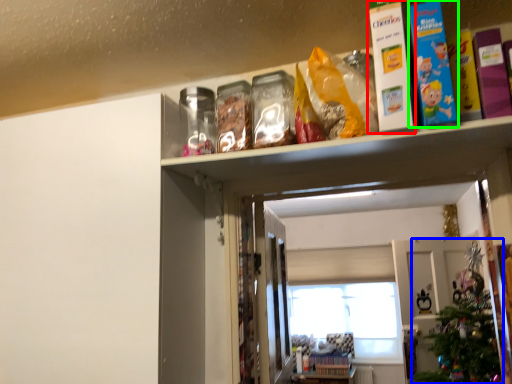
Question: Which object is positioned farthest from book (highlighted by a red box)? Select from christmas tree (highlighted by a blue box) and book (highlighted by a green box).

Choices:
 (A) christmas tree
 (B) book

Answer: (A)